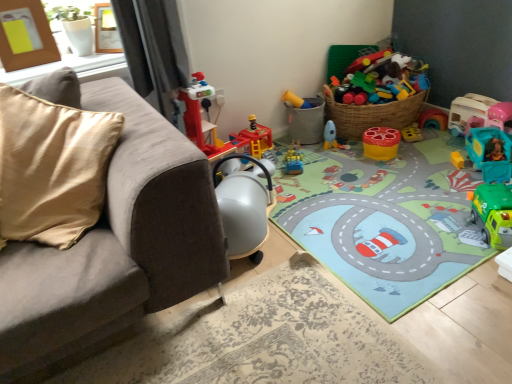
The width and height of the screenshot is (512, 384). Identify the location of vacant area that is in front of shiny yellow plastic train at center, which appears as the first toy when viewed from the left. (305, 179).